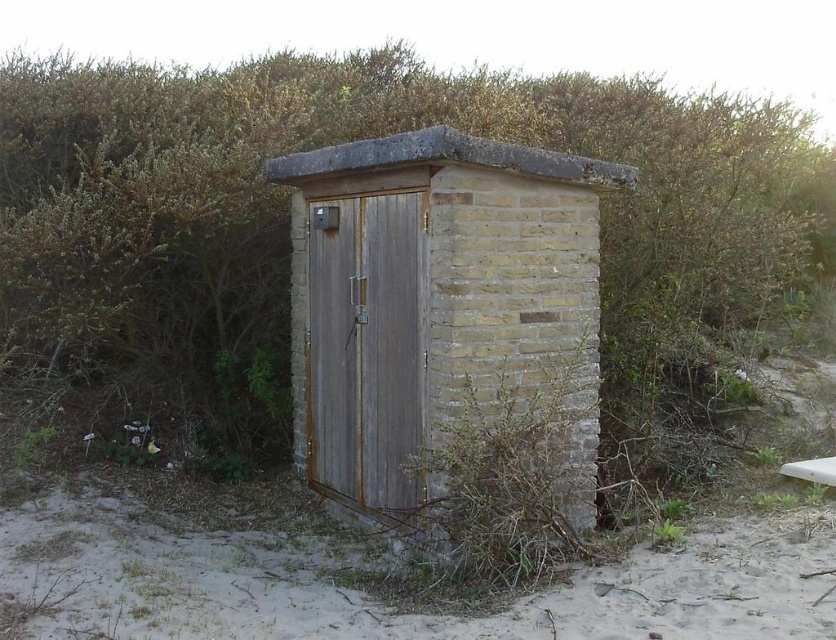
Question: Does green leafy hedge at center come in front of rusty wood hut at center?

Choices:
 (A) yes
 (B) no

Answer: (B)

Question: Which of the following is the closest to the observer?

Choices:
 (A) (187, 125)
 (B) (507, 172)

Answer: (B)

Question: From the image, what is the correct spatial relationship of green leafy hedge at center in relation to rusty wood hut at center?

Choices:
 (A) left
 (B) right

Answer: (A)

Question: Considering the relative positions of green leafy hedge at center and rusty wood hut at center in the image provided, where is green leafy hedge at center located with respect to rusty wood hut at center?

Choices:
 (A) left
 (B) right

Answer: (A)